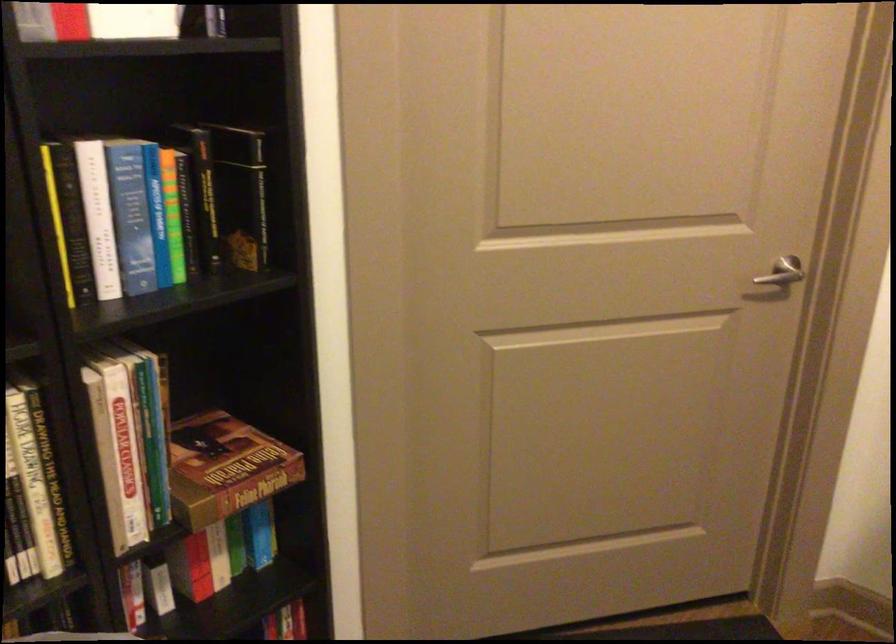
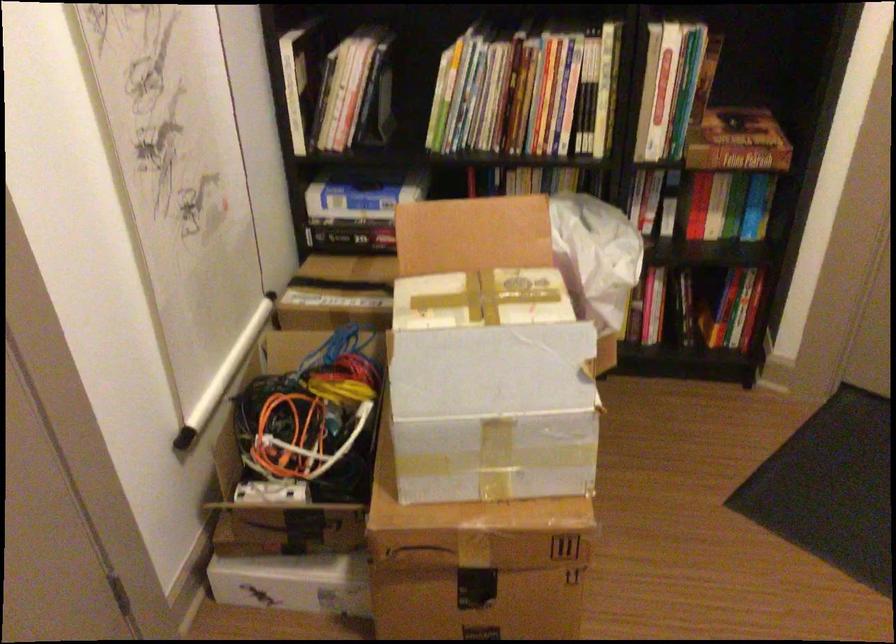
In the second image, find the point that corresponds to point 209,556 in the first image.

(703, 204)